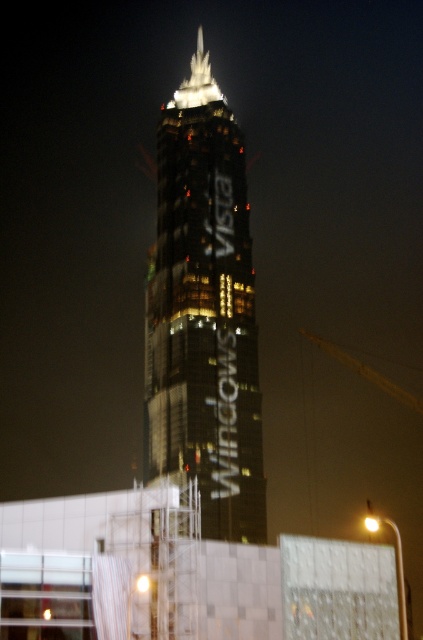
How distant is transparent plastic scaffolding at lower center from reflective glass tower at center?

transparent plastic scaffolding at lower center is 22.95 meters from reflective glass tower at center.

Can you confirm if transparent plastic scaffolding at lower center is positioned above reflective glass tower at center?

Actually, transparent plastic scaffolding at lower center is below reflective glass tower at center.

Image resolution: width=423 pixels, height=640 pixels. What do you see at coordinates (181, 573) in the screenshot?
I see `transparent plastic scaffolding at lower center` at bounding box center [181, 573].

What are the coordinates of `transparent plastic scaffolding at lower center` in the screenshot? It's located at (181, 573).

The height and width of the screenshot is (640, 423). What do you see at coordinates (181, 573) in the screenshot? I see `transparent plastic scaffolding at lower center` at bounding box center [181, 573].

Is point (112, 506) behind point (406, 390)?

That is False.

Locate an element on the screen. This screenshot has width=423, height=640. transparent plastic scaffolding at lower center is located at coordinates (181, 573).

Does point (206, 250) come behind point (411, 406)?

No, (206, 250) is closer to viewer.

Does reflective glass tower at center have a smaller size compared to wooden pole at upper center?

Incorrect, reflective glass tower at center is not smaller in size than wooden pole at upper center.

Find the location of a particular element. reflective glass tower at center is located at coordinates (203, 314).